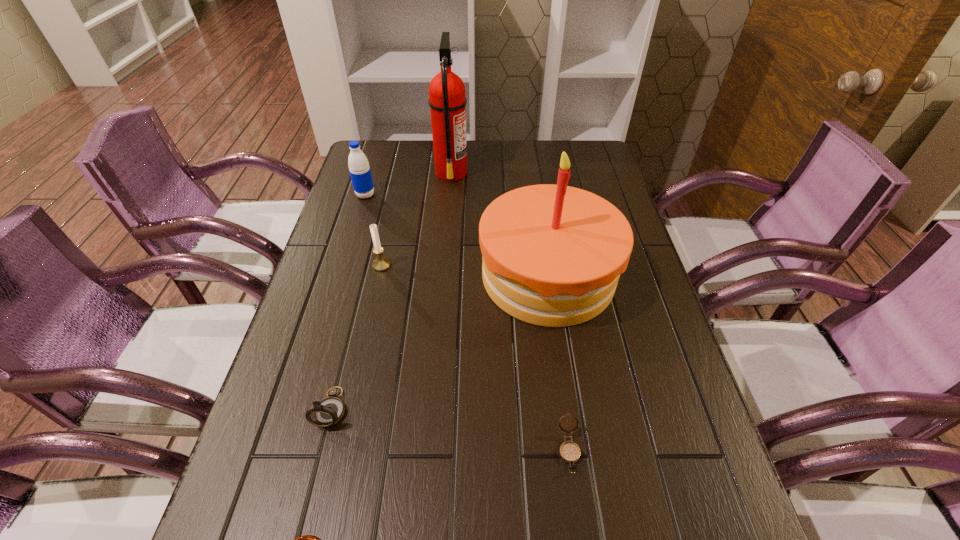
This screenshot has width=960, height=540. What are the coordinates of `free space at the far edge` in the screenshot? It's located at (412, 141).

In the image, there is a desktop. What are the coordinates of `vacant space at the left edge` in the screenshot? It's located at (338, 341).

At what (x,y) coordinates should I click in order to perform the action: click on vacant space at the right edge. Please return your answer as a coordinate pair (x, y). This screenshot has width=960, height=540. Looking at the image, I should click on (614, 394).

Locate an element on the screen. This screenshot has width=960, height=540. free spot at the far left corner of the desktop is located at coordinates (404, 150).

Where is `vacant space at the far right corner of the desktop`? The height and width of the screenshot is (540, 960). vacant space at the far right corner of the desktop is located at coordinates (596, 153).

The width and height of the screenshot is (960, 540). Identify the location of empty space that is in between the fifth shortest object and the rightmost compass. (468, 322).

Find the location of a particular element. vacant area between the fourth tallest object and the tallest compass is located at coordinates (356, 337).

I want to click on free space between the fifth shortest object and the third object from right to left, so [x=408, y=184].

Find the location of a particular element. The image size is (960, 540). free space between the tallest compass and the candle holder is located at coordinates (356, 337).

Locate an element on the screen. The height and width of the screenshot is (540, 960). free space between the second shortest object and the fourth shortest object is located at coordinates (475, 357).